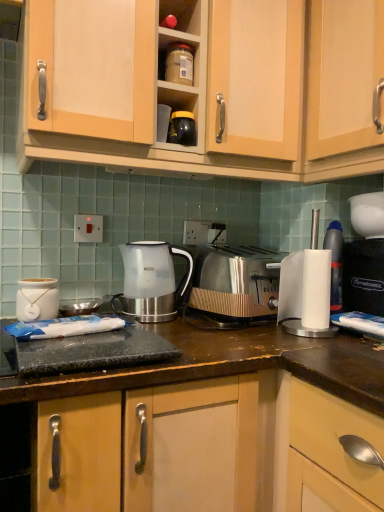
Measure the distance between light wood cabinet at upper right, arranged as the second cabinetry when viewed from the left, and camera.

light wood cabinet at upper right, arranged as the second cabinetry when viewed from the left, is 39.11 inches away from camera.

Describe the element at coordinates (335, 263) in the screenshot. The image size is (384, 512). I see `white plastic bottle at right` at that location.

Describe the element at coordinates (182, 128) in the screenshot. I see `shiny black jar at upper center, which appears as the first appliance when ordered from the bottom` at that location.

In order to click on translucent plastic kettle at center in this screenshot , I will do `click(151, 281)`.

In the scene shown: Measure the distance between black plastic bag at right and camera.

3.69 feet.

The width and height of the screenshot is (384, 512). In order to click on light wood cabinet at upper right, arranged as the second cabinetry when viewed from the left in this screenshot , I will do `click(343, 75)`.

Is white plastic bottle at right thinner than light wood cabinet at upper right, which appears as the first cabinetry when viewed from the right?

Yes.

Is light wood cabinet at upper right, arranged as the second cabinetry when viewed from the left, surrounded by white plastic bottle at right?

No, light wood cabinet at upper right, arranged as the second cabinetry when viewed from the left, is not a part of white plastic bottle at right.

Based on the photo, can you confirm if white plastic bottle at right is positioned to the right of light wood cabinet at upper right, arranged as the second cabinetry when viewed from the left?

No.

Is point (337, 265) positioned after point (315, 41)?

Yes, it is.

Measure the distance between satin metallic toaster at center and shiny black jar at upper center, which appears as the first appliance when ordered from the bottom.

17.01 inches.

Is satin metallic toaster at center looking in the opposite direction of shiny black jar at upper center, the 2th appliance viewed from the top?

No.

Where is `the 2nd appliance in front of the satin metallic toaster at center`? The height and width of the screenshot is (512, 384). the 2nd appliance in front of the satin metallic toaster at center is located at coordinates (182, 128).

Can you confirm if satin metallic toaster at center is shorter than shiny black jar at upper center, which appears as the first appliance when ordered from the bottom?

No, satin metallic toaster at center is not shorter than shiny black jar at upper center, which appears as the first appliance when ordered from the bottom.

Between matte plastic container at upper center, which is the 2th appliance in bottom-to-top order, and white plastic bottle at right, which one has smaller width?

Thinner between the two is white plastic bottle at right.

Consider the image. In the image, is matte plastic container at upper center, arranged as the first appliance when viewed from the top, positioned in front of or behind white plastic bottle at right?

In the image, matte plastic container at upper center, arranged as the first appliance when viewed from the top, appears in front of white plastic bottle at right.

How distant is matte plastic container at upper center, which is the 2th appliance in bottom-to-top order, from white plastic bottle at right?

The distance of matte plastic container at upper center, which is the 2th appliance in bottom-to-top order, from white plastic bottle at right is 24.99 inches.

From the image's perspective, does matte plastic container at upper center, arranged as the first appliance when viewed from the top, appear lower than white plastic bottle at right?

Incorrect, from the image's perspective, matte plastic container at upper center, arranged as the first appliance when viewed from the top, is higher than white plastic bottle at right.

Is light wood cabinet at upper right, arranged as the second cabinetry when viewed from the left, far away from matte plastic container at upper center, arranged as the first appliance when viewed from the top?

No, light wood cabinet at upper right, arranged as the second cabinetry when viewed from the left, is not far away from matte plastic container at upper center, arranged as the first appliance when viewed from the top.

Who is taller, light wood cabinet at upper right, which appears as the first cabinetry when viewed from the right, or matte plastic container at upper center, arranged as the first appliance when viewed from the top?

light wood cabinet at upper right, which appears as the first cabinetry when viewed from the right.

Is the position of light wood cabinet at upper right, which appears as the first cabinetry when viewed from the right, less distant than that of matte plastic container at upper center, which is the 2th appliance in bottom-to-top order?

Yes, light wood cabinet at upper right, which appears as the first cabinetry when viewed from the right, is in front of matte plastic container at upper center, which is the 2th appliance in bottom-to-top order.

Could you measure the distance between light wood cabinet at upper right, which appears as the first cabinetry when viewed from the right, and matte plastic container at upper center, arranged as the first appliance when viewed from the top?

light wood cabinet at upper right, which appears as the first cabinetry when viewed from the right, and matte plastic container at upper center, arranged as the first appliance when viewed from the top, are 16.04 inches apart.

Considering the sizes of objects translucent plastic kettle at center and matte plastic container at upper center, which is the 2th appliance in bottom-to-top order, in the image provided, who is shorter, translucent plastic kettle at center or matte plastic container at upper center, which is the 2th appliance in bottom-to-top order,?

Standing shorter between the two is matte plastic container at upper center, which is the 2th appliance in bottom-to-top order.

Considering the sizes of translucent plastic kettle at center and matte plastic container at upper center, which is the 2th appliance in bottom-to-top order, in the image, is translucent plastic kettle at center wider or thinner than matte plastic container at upper center, which is the 2th appliance in bottom-to-top order,?

In the image, translucent plastic kettle at center appears to be wider than matte plastic container at upper center, which is the 2th appliance in bottom-to-top order.

Is translucent plastic kettle at center with matte plastic container at upper center, which is the 2th appliance in bottom-to-top order?

translucent plastic kettle at center is not next to matte plastic container at upper center, which is the 2th appliance in bottom-to-top order, and they're not touching.

Does point (357, 33) appear closer or farther from the camera than point (335, 229)?

Point (357, 33) appears to be closer to the viewer than point (335, 229).

What are the coordinates of `bottle below the light wood cabinet at upper right, which appears as the first cabinetry when viewed from the right (from the image's perspective)` in the screenshot? It's located at (335, 263).

Considering the relative positions of light wood cabinet at upper right, which appears as the first cabinetry when viewed from the right, and white plastic bottle at right in the image provided, is light wood cabinet at upper right, which appears as the first cabinetry when viewed from the right, to the left or to the right of white plastic bottle at right?

Based on their positions, light wood cabinet at upper right, which appears as the first cabinetry when viewed from the right, is located to the right of white plastic bottle at right.

In terms of height, does light wood cabinet at upper right, arranged as the second cabinetry when viewed from the left, look taller or shorter compared to white plastic bottle at right?

light wood cabinet at upper right, arranged as the second cabinetry when viewed from the left, is taller than white plastic bottle at right.

Between satin metallic toaster at center and white plastic bottle at right, which one has smaller width?

Thinner between the two is white plastic bottle at right.

Does point (254, 275) come farther from viewer compared to point (333, 272)?

Yes, point (254, 275) is behind point (333, 272).

From the image's perspective, is satin metallic toaster at center located above or below white plastic bottle at right?

Based on their image positions, satin metallic toaster at center is located beneath white plastic bottle at right.

The image size is (384, 512). What are the coordinates of `cabinetry that is on the right side of white plastic bottle at right` in the screenshot? It's located at (343, 75).

Find the location of a particular element. the 1st appliance above the satin metallic toaster at center (from the image's perspective) is located at coordinates (182, 128).

When comparing their distances from light wood cabinet at upper right, arranged as the second cabinetry when viewed from the left, does wooden cabinet at upper center, the 1th cabinetry in the left-to-right sequence, or matte plastic container at upper center, which is the 2th appliance in bottom-to-top order, seem further?

The object further to light wood cabinet at upper right, arranged as the second cabinetry when viewed from the left, is matte plastic container at upper center, which is the 2th appliance in bottom-to-top order.

Which object lies further to the anchor point black plastic bag at right, satin metallic toaster at center or white ceramic jar at left?

Based on the image, white ceramic jar at left appears to be further to black plastic bag at right.

Considering their positions, is translucent plastic kettle at center positioned closer to light wood cabinet at upper right, which appears as the first cabinetry when viewed from the right, than wooden cabinet at upper center, marked as the 2th cabinetry in a right-to-left arrangement?

wooden cabinet at upper center, marked as the 2th cabinetry in a right-to-left arrangement, lies closer to light wood cabinet at upper right, which appears as the first cabinetry when viewed from the right, than the other object.

Based on their spatial positions, is white ceramic jar at left or white plastic bottle at right further from black plastic bag at right?

white ceramic jar at left is further to black plastic bag at right.

From the picture: Based on their spatial positions, is translucent plastic kettle at center or white ceramic jar at left further from light wood cabinet at upper right, arranged as the second cabinetry when viewed from the left?

white ceramic jar at left.

Looking at the image, which one is located closer to white ceramic jar at left, satin metallic toaster at center or black plastic bag at right?

Among the two, satin metallic toaster at center is located nearer to white ceramic jar at left.

From the image, which object appears to be farther from translucent plastic kettle at center, wooden cabinet at upper center, the 1th cabinetry in the left-to-right sequence, or satin metallic toaster at center?

Among the two, wooden cabinet at upper center, the 1th cabinetry in the left-to-right sequence, is located further to translucent plastic kettle at center.

Which object lies further to the anchor point white ceramic jar at left, white plastic bottle at right or satin metallic toaster at center?

white plastic bottle at right.

Image resolution: width=384 pixels, height=512 pixels. Identify the location of cabinetry between translucent plastic kettle at center and light wood cabinet at upper right, arranged as the second cabinetry when viewed from the left, in the horizontal direction. (218, 91).

Identify the location of cabinetry located between matte plastic container at upper center, which is the 2th appliance in bottom-to-top order, and black plastic bag at right in the left-right direction. (343, 75).

Where is `appliance between matte plastic container at upper center, arranged as the first appliance when viewed from the top, and black plastic bag at right`? The width and height of the screenshot is (384, 512). appliance between matte plastic container at upper center, arranged as the first appliance when viewed from the top, and black plastic bag at right is located at coordinates (182, 128).

In order to click on home appliance between matte plastic container at upper center, arranged as the first appliance when viewed from the top, and satin metallic toaster at center from top to bottom in this screenshot , I will do `click(363, 276)`.